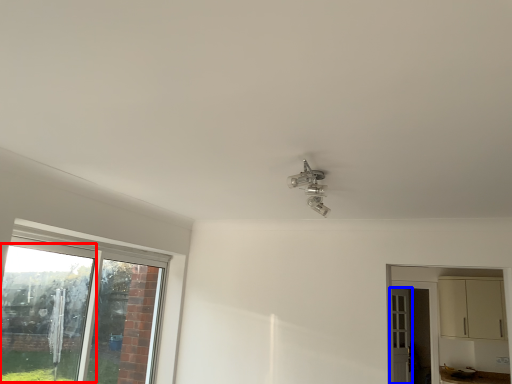
Question: Which object appears farthest to the camera in this image, window screen (highlighted by a red box) or door (highlighted by a blue box)?

Choices:
 (A) window screen
 (B) door

Answer: (B)